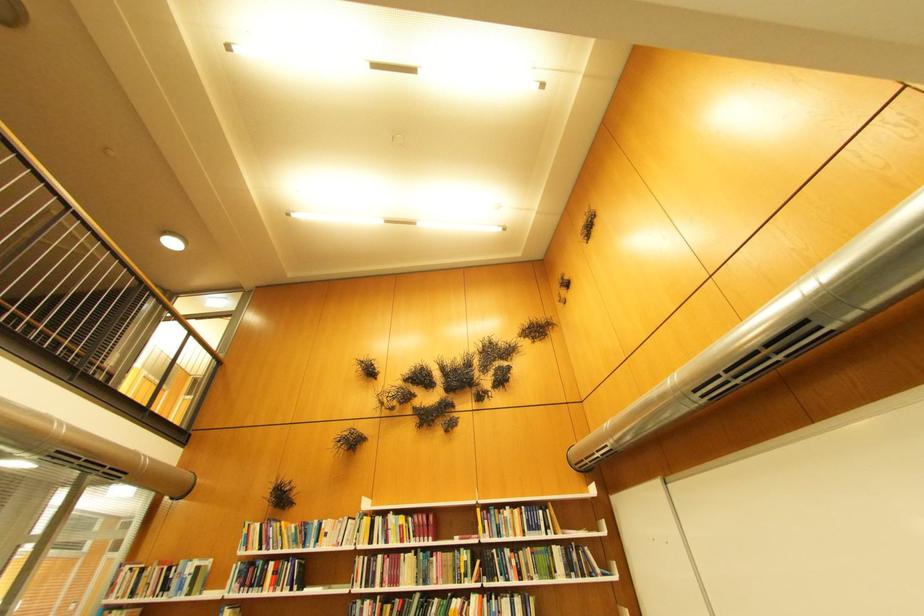
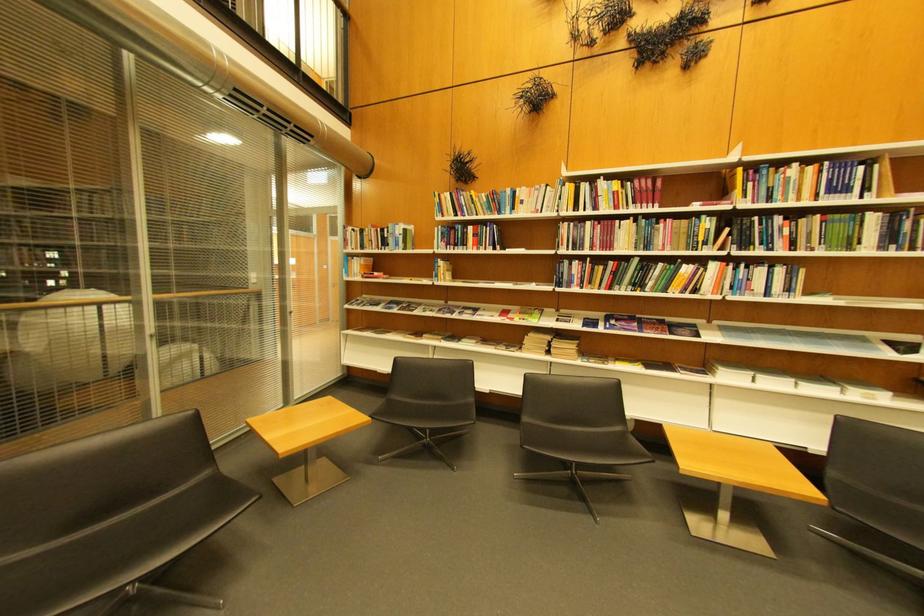
In the second image, find the point that corresponds to (x=427, y=517) in the first image.

(648, 183)